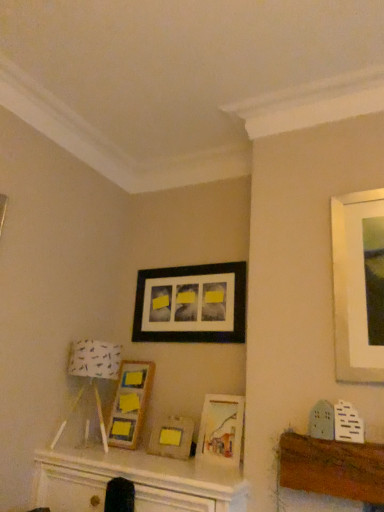
Question: Is white fabric lampshade at left inside the boundaries of wooden frame at center, the second picture frame positioned from the top, or outside?

Choices:
 (A) inside
 (B) outside

Answer: (B)

Question: Considering the positions of point (102, 342) and point (127, 359), is point (102, 342) closer or farther from the camera than point (127, 359)?

Choices:
 (A) closer
 (B) farther

Answer: (A)

Question: Estimate the real-world distances between objects in this image. Which object is farther from the wooden frame at center, the second picture frame positioned from the top?

Choices:
 (A) matte wooden picture frame at center, which is counted as the third picture frame, starting from the top
 (B) black matte picture frame at upper center, which ranks as the 1th picture frame in top-to-bottom order
 (C) white fabric lampshade at left
 (D) matte silver picture frame at center, arranged as the first picture frame when ordered from the bottom

Answer: (A)

Question: Considering the real-world distances, which object is farthest from the matte wooden picture frame at center, which is counted as the third picture frame, starting from the top?

Choices:
 (A) matte silver picture frame at center, arranged as the first picture frame when ordered from the bottom
 (B) wooden frame at center, the third picture frame from the bottom
 (C) black matte picture frame at upper center, which ranks as the 1th picture frame in top-to-bottom order
 (D) white fabric lampshade at left

Answer: (D)